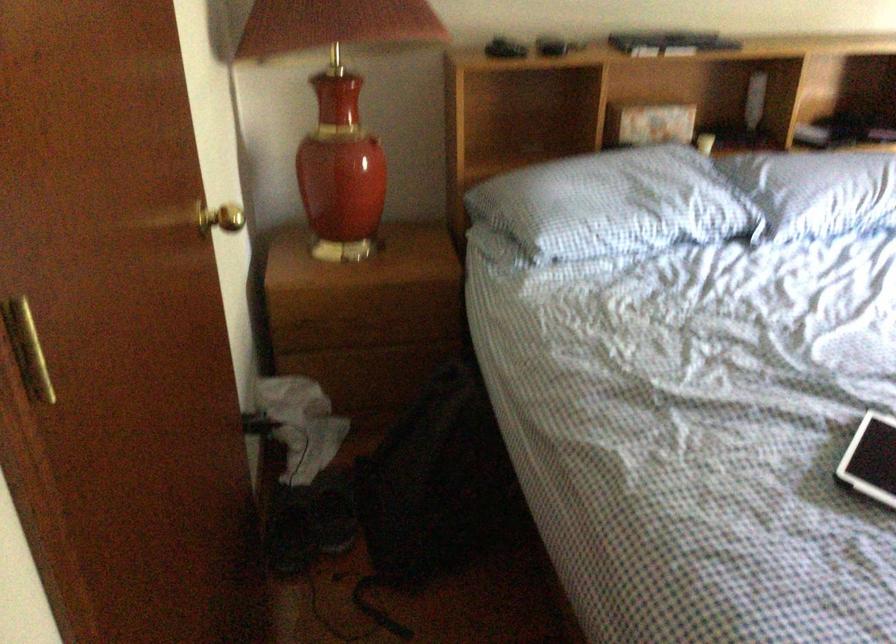
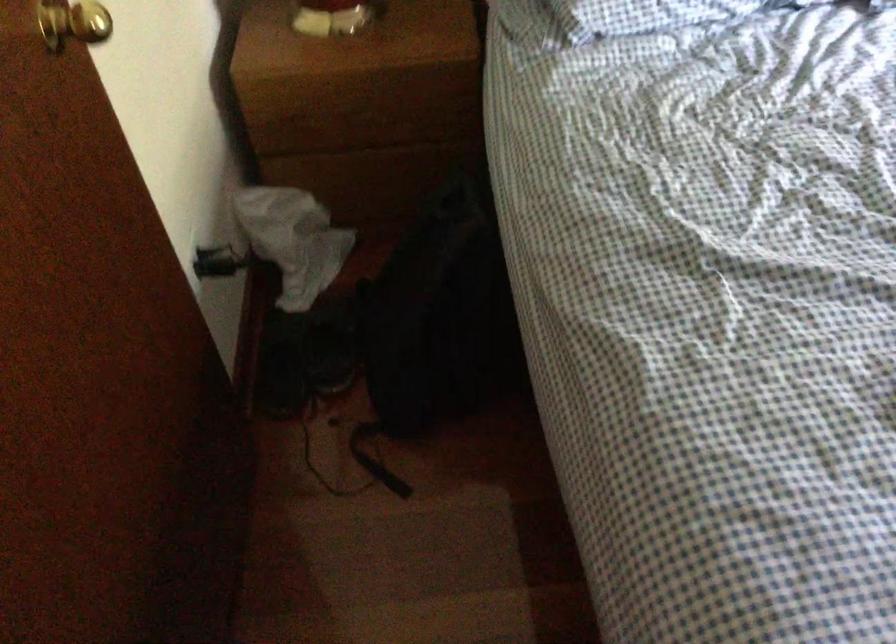
Locate, in the second image, the point that corresponds to point 210,219 in the first image.

(73, 23)